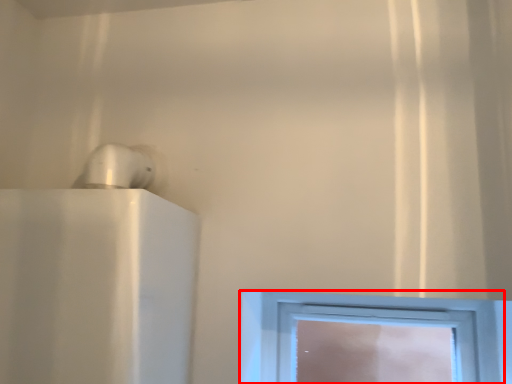
Question: In this image, where is window (annotated by the red box) located relative to appliance?

Choices:
 (A) left
 (B) right

Answer: (B)